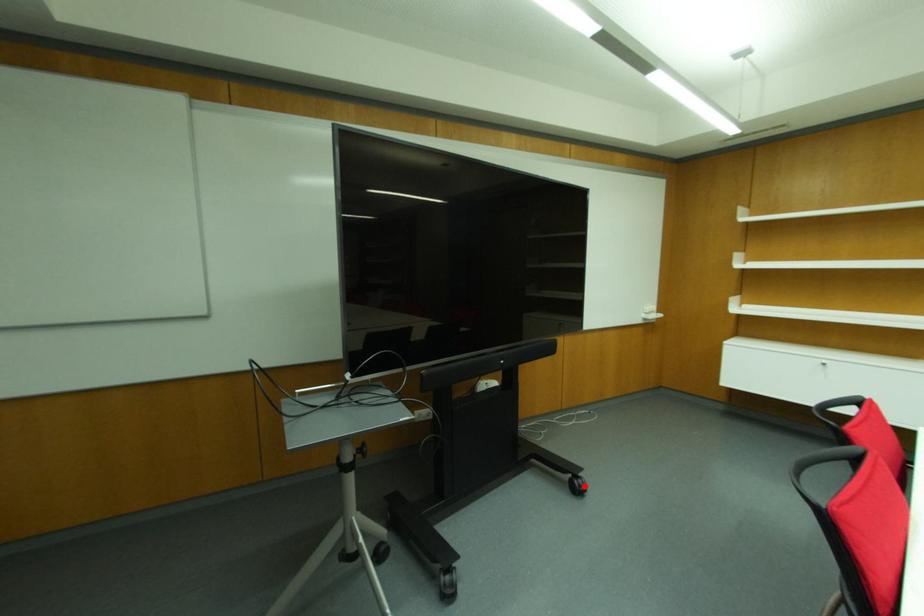
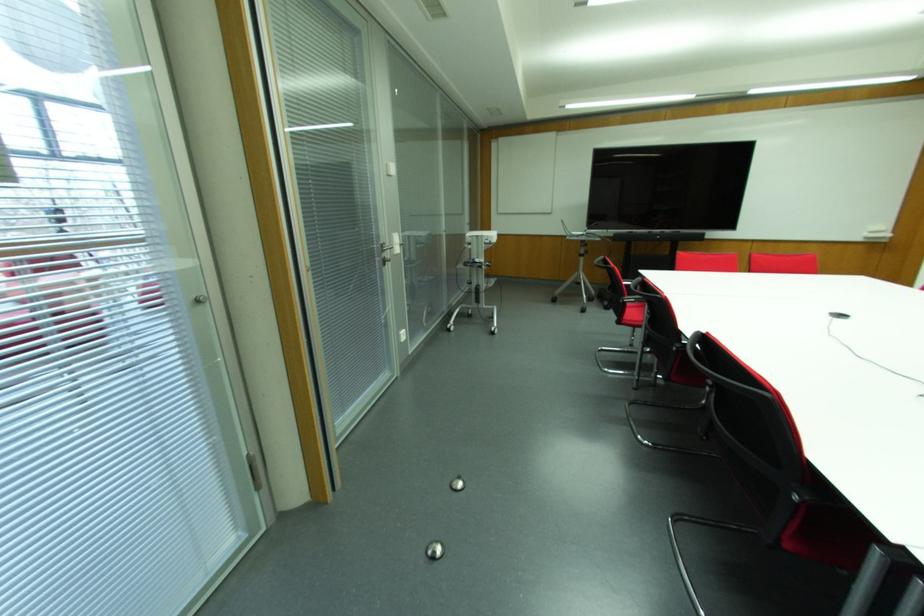
Question: I am providing you with two images of the same scene from different viewpoints. A red point is marked on the first image. Can you still see the location of the red point in image 2?

Choices:
 (A) Yes
 (B) No

Answer: (B)